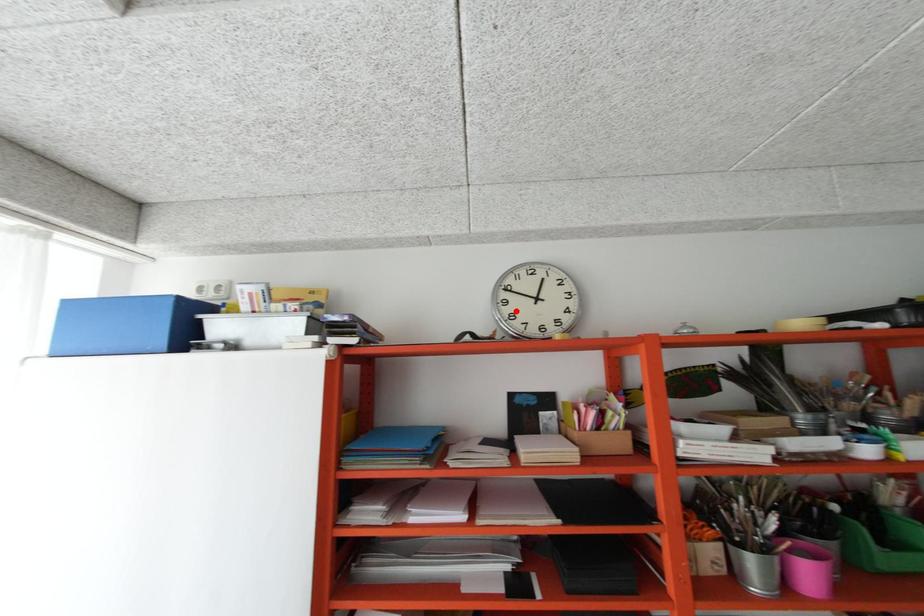
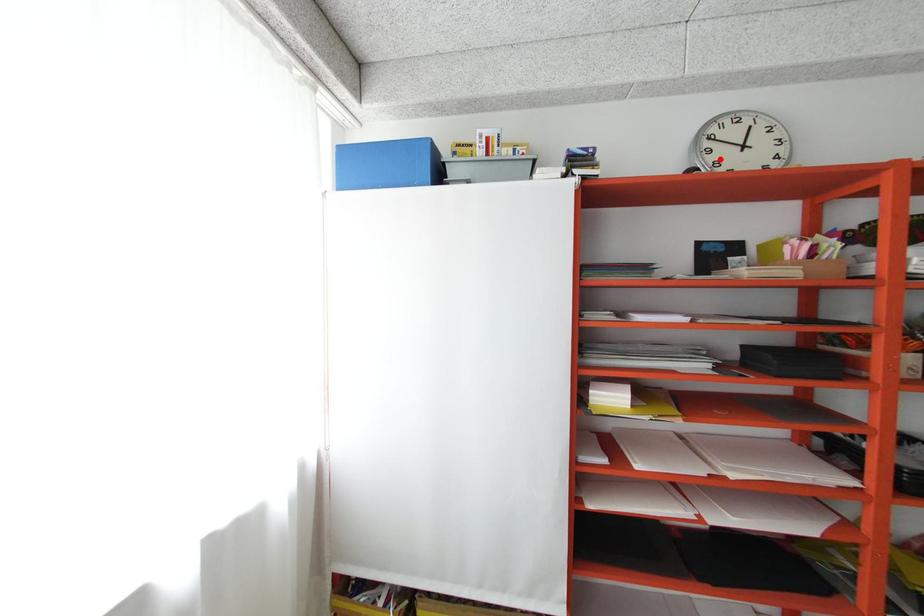
I am providing you with two images of the same scene from different viewpoints. A red point is marked on the first image and another point is marked on the second image. Do the highlighted points in image1 and image2 indicate the same real-world spot?

Yes